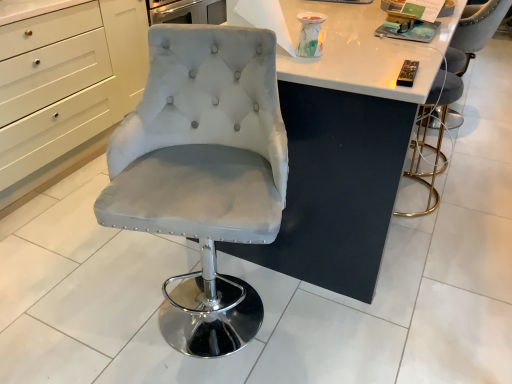
The width and height of the screenshot is (512, 384). I want to click on free point in front of velvet grey chair at right, the first chair viewed from the right, so coord(481,145).